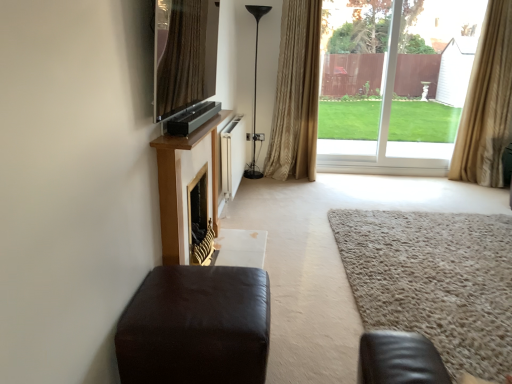
Identify the location of beige shaggy carpet at lower right. The width and height of the screenshot is (512, 384). (434, 279).

Describe the element at coordinates (255, 94) in the screenshot. I see `black matte floor lamp at center` at that location.

Find the location of `matte black ottoman at lower left`. matte black ottoman at lower left is located at coordinates (196, 327).

The width and height of the screenshot is (512, 384). Find the location of `beige shaggy carpet at lower right`. beige shaggy carpet at lower right is located at coordinates (x=434, y=279).

Is there a large distance between matte black tv at upper center and black matte floor lamp at center?

Yes, matte black tv at upper center is far from black matte floor lamp at center.

Does matte black tv at upper center have a greater height compared to black matte floor lamp at center?

No.

This screenshot has width=512, height=384. In order to click on window screen above the black matte floor lamp at center (from a real-world perspective) in this screenshot , I will do `click(184, 54)`.

Starting from the matte black tv at upper center, which curtain is the 1st one to the right? Please provide its 2D coordinates.

[(296, 94)]

Considering the relative sizes of gold textured curtain at center, arranged as the 2th curtain when viewed from the right, and matte black tv at upper center in the image provided, is gold textured curtain at center, arranged as the 2th curtain when viewed from the right, wider than matte black tv at upper center?

Yes.

From a real-world perspective, is gold textured curtain at center, arranged as the 2th curtain when viewed from the right, positioned under matte black tv at upper center based on gravity?

Yes, from a real-world perspective, gold textured curtain at center, arranged as the 2th curtain when viewed from the right, is beneath matte black tv at upper center.

Is matte black tv at upper center completely or partially inside gold textured curtain at center, which is the 1th curtain from left to right?

Actually, matte black tv at upper center is outside gold textured curtain at center, which is the 1th curtain from left to right.

Is transparent glass door at upper right taller or shorter than beige fabric curtain at right, acting as the 2th curtain starting from the left?

In the image, transparent glass door at upper right appears to be shorter than beige fabric curtain at right, acting as the 2th curtain starting from the left.

What's the angular difference between transparent glass door at upper right and beige fabric curtain at right, acting as the 2th curtain starting from the left,'s facing directions?

2.25 degrees separate the facing orientations of transparent glass door at upper right and beige fabric curtain at right, acting as the 2th curtain starting from the left.

Is transparent glass door at upper right oriented towards beige fabric curtain at right, the 1th curtain positioned from the right?

Yes, transparent glass door at upper right faces towards beige fabric curtain at right, the 1th curtain positioned from the right.

Based on their sizes in the image, would you say beige fabric curtain at right, acting as the 2th curtain starting from the left, is bigger or smaller than gold textured curtain at center, which is the 1th curtain from left to right?

Clearly, beige fabric curtain at right, acting as the 2th curtain starting from the left, is larger in size than gold textured curtain at center, which is the 1th curtain from left to right.

Is beige fabric curtain at right, the 1th curtain positioned from the right, thinner than gold textured curtain at center, arranged as the 2th curtain when viewed from the right?

Incorrect, the width of beige fabric curtain at right, the 1th curtain positioned from the right, is not less than that of gold textured curtain at center, arranged as the 2th curtain when viewed from the right.

Is beige fabric curtain at right, acting as the 2th curtain starting from the left, in contact with gold textured curtain at center, arranged as the 2th curtain when viewed from the right?

They are not placed beside each other.

You are a GUI agent. You are given a task and a screenshot of the screen. Output one action in this format:
    pyautogui.click(x=<x>, y=<y>)
    Task: Click on the curtain on the right side of gold textured curtain at center, arranged as the 2th curtain when viewed from the right
    The height and width of the screenshot is (384, 512).
    Given the screenshot: What is the action you would take?
    pyautogui.click(x=487, y=103)

Is matte black ottoman at lower left at the right side of gold textured curtain at center, which is the 1th curtain from left to right?

No.

Is point (231, 323) positioned behind point (303, 73)?

No, it is in front of (303, 73).

From the image's perspective, is matte black ottoman at lower left over gold textured curtain at center, which is the 1th curtain from left to right?

Actually, matte black ottoman at lower left appears below gold textured curtain at center, which is the 1th curtain from left to right, in the image.

Is point (480, 160) closer to camera compared to point (192, 103)?

No.

Is beige fabric curtain at right, the 1th curtain positioned from the right, far from matte black tv at upper center?

Indeed, beige fabric curtain at right, the 1th curtain positioned from the right, is not near matte black tv at upper center.

Can matte black tv at upper center be found inside beige fabric curtain at right, the 1th curtain positioned from the right?

That's incorrect, matte black tv at upper center is not inside beige fabric curtain at right, the 1th curtain positioned from the right.

How many degrees apart are the facing directions of beige fabric curtain at right, the 1th curtain positioned from the right, and matte black tv at upper center?

The facing directions of beige fabric curtain at right, the 1th curtain positioned from the right, and matte black tv at upper center are 92.2 degrees apart.

Can you confirm if beige fabric curtain at right, the 1th curtain positioned from the right, is positioned to the right of black matte floor lamp at center?

Correct, you'll find beige fabric curtain at right, the 1th curtain positioned from the right, to the right of black matte floor lamp at center.

Is beige fabric curtain at right, acting as the 2th curtain starting from the left, not within black matte floor lamp at center?

That's correct, beige fabric curtain at right, acting as the 2th curtain starting from the left, is outside of black matte floor lamp at center.

Does beige fabric curtain at right, the 1th curtain positioned from the right, have a larger size compared to black matte floor lamp at center?

Yes.

From a real-world perspective, is beige fabric curtain at right, acting as the 2th curtain starting from the left, positioned over black matte floor lamp at center based on gravity?

Indeed, from a real-world perspective, beige fabric curtain at right, acting as the 2th curtain starting from the left, stands above black matte floor lamp at center.

Image resolution: width=512 pixels, height=384 pixels. What are the coordinates of `lamp below the matte black tv at upper center (from a real-world perspective)` in the screenshot? It's located at (255, 94).

The image size is (512, 384). What are the coordinates of `the 1st curtain counting from the right side of the matte black tv at upper center` in the screenshot? It's located at [x=296, y=94].

Based on their spatial positions, is matte black ottoman at lower left or matte black tv at upper center closer to black matte floor lamp at center?

The object closer to black matte floor lamp at center is matte black tv at upper center.

Which object lies nearer to the anchor point beige shaggy carpet at lower right, gold textured curtain at center, which is the 1th curtain from left to right, or transparent glass door at upper right?

Based on the image, gold textured curtain at center, which is the 1th curtain from left to right, appears to be nearer to beige shaggy carpet at lower right.

Looking at the image, which one is located closer to matte black tv at upper center, beige fabric curtain at right, acting as the 2th curtain starting from the left, or black matte floor lamp at center?

black matte floor lamp at center.

Considering their positions, is gold textured curtain at center, arranged as the 2th curtain when viewed from the right, positioned further to black matte floor lamp at center than matte black ottoman at lower left?

Among the two, matte black ottoman at lower left is located further to black matte floor lamp at center.

When comparing their distances from transparent glass door at upper right, does black matte floor lamp at center or beige shaggy carpet at lower right seem further?

The object further to transparent glass door at upper right is beige shaggy carpet at lower right.

From the image, which object appears to be farther from gold textured curtain at center, which is the 1th curtain from left to right, beige shaggy carpet at lower right or beige fabric curtain at right, acting as the 2th curtain starting from the left?

Among the two, beige shaggy carpet at lower right is located further to gold textured curtain at center, which is the 1th curtain from left to right.

Considering their positions, is beige fabric curtain at right, the 1th curtain positioned from the right, positioned further to beige shaggy carpet at lower right than transparent glass door at upper right?

Based on the image, transparent glass door at upper right appears to be further to beige shaggy carpet at lower right.

When comparing their distances from matte black ottoman at lower left, does transparent glass door at upper right or matte black tv at upper center seem closer?

matte black tv at upper center lies closer to matte black ottoman at lower left than the other object.

Identify the location of window screen positioned between matte black ottoman at lower left and black matte floor lamp at center from near to far. This screenshot has width=512, height=384. [184, 54].

Image resolution: width=512 pixels, height=384 pixels. Find the location of `plain between matte black ottoman at lower left and beige fabric curtain at right, acting as the 2th curtain starting from the left, along the z-axis`. plain between matte black ottoman at lower left and beige fabric curtain at right, acting as the 2th curtain starting from the left, along the z-axis is located at coordinates (434, 279).

At what (x,y) coordinates should I click in order to perform the action: click on lamp between matte black tv at upper center and transparent glass door at upper right from front to back. Please return your answer as a coordinate pair (x, y). The height and width of the screenshot is (384, 512). Looking at the image, I should click on [x=255, y=94].

Identify the location of plain between matte black tv at upper center and black matte floor lamp at center from front to back. This screenshot has height=384, width=512. [x=434, y=279].